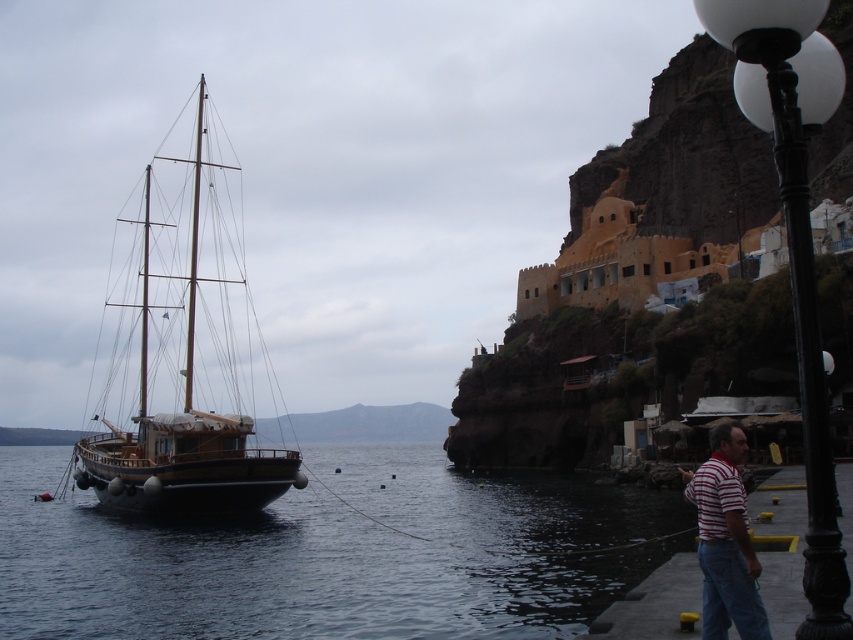
You are standing on the dock and see the dark blue water at left and the black metal lamp post at lower right. Which object is closer to you?

The dark blue water at left is closer to you because it is further to the viewer than the black metal lamp post at lower right.

You are standing on the dock and see a point marked at coordinates [329,554]. Based on the scene description, can you determine if this point is on land or water?

The point at coordinates [329,554] is on dark blue water at left, so it is on water.